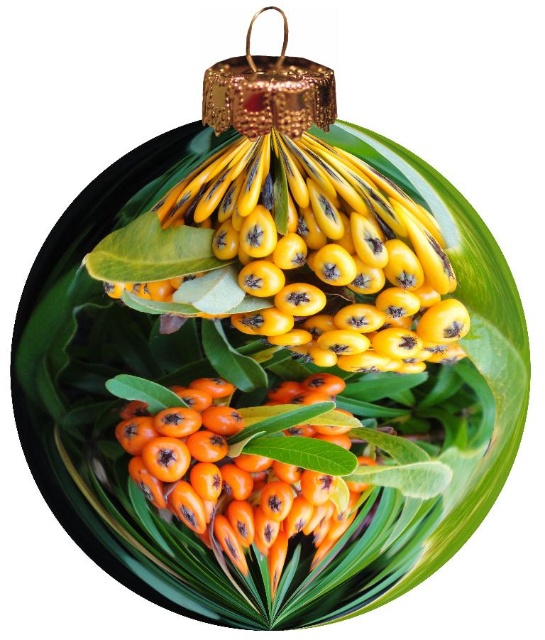
Question: Can you confirm if shiny yellow berries at center is wider than orange matte berries at center?

Choices:
 (A) no
 (B) yes

Answer: (B)

Question: Is shiny yellow berries at center to the left of orange matte berries at center from the viewer's perspective?

Choices:
 (A) no
 (B) yes

Answer: (A)

Question: Among these objects, which one is nearest to the camera?

Choices:
 (A) orange matte berries at center
 (B) shiny yellow berries at center

Answer: (B)

Question: Can you confirm if shiny yellow berries at center is positioned to the left of orange matte berries at center?

Choices:
 (A) no
 (B) yes

Answer: (A)